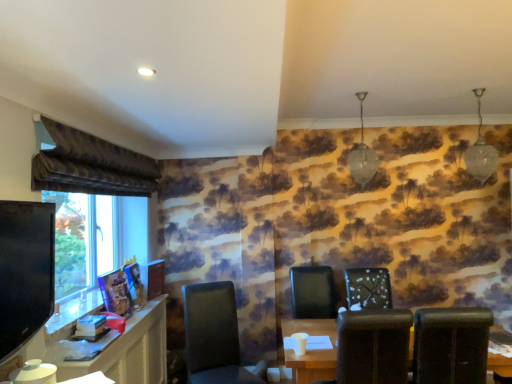
What do you see at coordinates (91, 165) in the screenshot? I see `velvet brown curtain at upper left` at bounding box center [91, 165].

What are the coordinates of `white textured chair at center, the second chair viewed from the right` in the screenshot? It's located at (368, 288).

This screenshot has height=384, width=512. Identify the location of matte brown table at lower center. (313, 350).

This screenshot has height=384, width=512. I want to click on matte black chair at center, which is the 1th chair from left to right, so click(x=214, y=336).

Describe the element at coordinates (373, 346) in the screenshot. I see `brown leather chair at center, which is counted as the 3th chair, starting from the right` at that location.

This screenshot has width=512, height=384. In order to click on velvet brown curtain at upper left in this screenshot , I will do `click(91, 165)`.

Consider the image. Is black leather chair at lower right, acting as the 4th chair starting from the left, shorter than matte black chair at center, which ranks as the fourth chair in right-to-left order?

Indeed, black leather chair at lower right, acting as the 4th chair starting from the left, has a lesser height compared to matte black chair at center, which ranks as the fourth chair in right-to-left order.

What are the coordinates of `the 1st chair in front of the matte black chair at center, which is the 1th chair from left to right, counting from the anchor's position` in the screenshot? It's located at (451, 345).

From a real-world perspective, is black leather chair at lower right, acting as the 4th chair starting from the left, on top of matte black chair at center, which is the 1th chair from left to right?

Yes, from a real-world perspective, black leather chair at lower right, acting as the 4th chair starting from the left, is on top of matte black chair at center, which is the 1th chair from left to right.

Is matte black chair at center, which ranks as the fourth chair in right-to-left order, inside black leather chair at lower right, the 1th chair viewed from the right?

No, matte black chair at center, which ranks as the fourth chair in right-to-left order, is not surrounded by black leather chair at lower right, the 1th chair viewed from the right.

Is matte brown table at lower center to the right of matte black computer desk at lower left from the viewer's perspective?

Yes.

From a real-world perspective, is matte brown table at lower center under matte black computer desk at lower left?

No, from a real-world perspective, matte brown table at lower center is not below matte black computer desk at lower left.

What's the angular difference between matte brown table at lower center and matte black computer desk at lower left's facing directions?

The angular difference between matte brown table at lower center and matte black computer desk at lower left is 89.6 degrees.

Considering the positions of points (300, 380) and (119, 367), is point (300, 380) farther from camera compared to point (119, 367)?

That is False.

Is velvet brown curtain at upper left closer to the viewer compared to black glossy tv at left?

No, velvet brown curtain at upper left is further to the viewer.

Considering the positions of objects velvet brown curtain at upper left and black glossy tv at left in the image provided, who is more to the right, velvet brown curtain at upper left or black glossy tv at left?

black glossy tv at left is more to the right.

Locate an element on the screen. The image size is (512, 384). television below the velvet brown curtain at upper left (from the image's perspective) is located at coordinates (25, 271).

Can you confirm if brown leather chair at center, which is counted as the 3th chair, starting from the right, is taller than matte black computer desk at lower left?

Incorrect, the height of brown leather chair at center, which is counted as the 3th chair, starting from the right, is not larger of that of matte black computer desk at lower left.

Does point (384, 378) come behind point (108, 349)?

Yes, it is.

Which is behind, brown leather chair at center, the second chair when ordered from left to right, or matte black computer desk at lower left?

brown leather chair at center, the second chair when ordered from left to right, is further from the camera.

From the image's perspective, between brown leather chair at center, the second chair when ordered from left to right, and matte black computer desk at lower left, who is located below?

matte black computer desk at lower left appears lower in the image.

Between black leather chair at lower right, the 1th chair viewed from the right, and brown leather chair at center, which is counted as the 3th chair, starting from the right, which one has less height?

With less height is black leather chair at lower right, the 1th chair viewed from the right.

From the image's perspective, who appears lower, black leather chair at lower right, the 1th chair viewed from the right, or brown leather chair at center, which is counted as the 3th chair, starting from the right?

From the image's view, brown leather chair at center, which is counted as the 3th chair, starting from the right, is below.

From a real-world perspective, is black leather chair at lower right, the 1th chair viewed from the right, over brown leather chair at center, which is counted as the 3th chair, starting from the right?

No.

Which object is further away from the camera, black leather chair at lower right, the 1th chair viewed from the right, or brown leather chair at center, which is counted as the 3th chair, starting from the right?

black leather chair at lower right, the 1th chair viewed from the right, is further away from the camera.

Which object is further away from the camera, matte black chair at center, which ranks as the fourth chair in right-to-left order, or velvet brown curtain at upper left?

matte black chair at center, which ranks as the fourth chair in right-to-left order, is behind.

Could you tell me if matte black chair at center, which is the 1th chair from left to right, is facing velvet brown curtain at upper left?

No, matte black chair at center, which is the 1th chair from left to right, is not turned towards velvet brown curtain at upper left.

Consider the image. Are matte black chair at center, which ranks as the fourth chair in right-to-left order, and velvet brown curtain at upper left far apart?

Yes, matte black chair at center, which ranks as the fourth chair in right-to-left order, and velvet brown curtain at upper left are quite far apart.

From the picture: From a real-world perspective, between matte black chair at center, which is the 1th chair from left to right, and velvet brown curtain at upper left, who is vertically lower?

matte black chair at center, which is the 1th chair from left to right, is physically lower.

Which is more to the left, matte black computer desk at lower left or matte brown table at lower center?

matte black computer desk at lower left is more to the left.

How distant is matte black computer desk at lower left from matte brown table at lower center?

matte black computer desk at lower left is 3.76 feet away from matte brown table at lower center.

From the image's perspective, relative to matte brown table at lower center, is matte black computer desk at lower left above or below?

Clearly, from the image's perspective, matte black computer desk at lower left is below matte brown table at lower center.

Could you tell me if matte black computer desk at lower left is turned towards matte brown table at lower center?

Yes, matte black computer desk at lower left is aimed at matte brown table at lower center.

From the image's perspective, starting from the matte black chair at center, which is the 1th chair from left to right, which chair is the 2nd one above? Please provide its 2D coordinates.

[(451, 345)]

You are a GUI agent. You are given a task and a screenshot of the screen. Output one action in this format:
    pyautogui.click(x=<x>, y=<y>)
    Task: Click on the table behind the matte black computer desk at lower left
    Image resolution: width=512 pixels, height=384 pixels.
    Given the screenshot: What is the action you would take?
    pyautogui.click(x=313, y=350)

Which object lies nearer to the anchor point brown leather chair at center, which is counted as the 3th chair, starting from the right, matte black computer desk at lower left or matte brown table at lower center?

matte brown table at lower center.

Which object lies further to the anchor point white textured chair at center, the second chair viewed from the right, matte black chair at center, which ranks as the fourth chair in right-to-left order, or brown leather chair at center, which is counted as the 3th chair, starting from the right?

matte black chair at center, which ranks as the fourth chair in right-to-left order, is further to white textured chair at center, the second chair viewed from the right.

Which object lies further to the anchor point brown leather chair at center, which is counted as the 3th chair, starting from the right, white textured chair at center, which is counted as the third chair, starting from the left, or matte black chair at center, which ranks as the fourth chair in right-to-left order?

Based on the image, matte black chair at center, which ranks as the fourth chair in right-to-left order, appears to be further to brown leather chair at center, which is counted as the 3th chair, starting from the right.

Estimate the real-world distances between objects in this image. Which object is further from velvet brown curtain at upper left, matte brown table at lower center or matte black computer desk at lower left?

Among the two, matte brown table at lower center is located further to velvet brown curtain at upper left.

Based on their spatial positions, is black leather chair at lower right, the 1th chair viewed from the right, or matte black computer desk at lower left further from velvet brown curtain at upper left?

Among the two, black leather chair at lower right, the 1th chair viewed from the right, is located further to velvet brown curtain at upper left.

From the image, which object appears to be farther from matte black chair at center, which ranks as the fourth chair in right-to-left order, matte black computer desk at lower left or brown leather chair at center, the second chair when ordered from left to right?

brown leather chair at center, the second chair when ordered from left to right, is further to matte black chair at center, which ranks as the fourth chair in right-to-left order.

Which object lies nearer to the anchor point matte black computer desk at lower left, black leather chair at lower right, the 1th chair viewed from the right, or velvet brown curtain at upper left?

The object closer to matte black computer desk at lower left is velvet brown curtain at upper left.

Looking at this image, looking at the image, which one is located further to brown leather chair at center, the second chair when ordered from left to right, white textured chair at center, the second chair viewed from the right, or velvet brown curtain at upper left?

velvet brown curtain at upper left lies further to brown leather chair at center, the second chair when ordered from left to right, than the other object.

Find the location of `chair situated between matte black computer desk at lower left and brown leather chair at center, which is counted as the 3th chair, starting from the right, from left to right`. chair situated between matte black computer desk at lower left and brown leather chair at center, which is counted as the 3th chair, starting from the right, from left to right is located at coordinates (214, 336).

Where is `computer desk between velvet brown curtain at upper left and black leather chair at lower right, acting as the 4th chair starting from the left, from left to right`? computer desk between velvet brown curtain at upper left and black leather chair at lower right, acting as the 4th chair starting from the left, from left to right is located at coordinates (125, 351).

Where is `computer desk between velvet brown curtain at upper left and matte brown table at lower center`? This screenshot has width=512, height=384. computer desk between velvet brown curtain at upper left and matte brown table at lower center is located at coordinates (125, 351).

The height and width of the screenshot is (384, 512). Find the location of `computer desk between velvet brown curtain at upper left and white textured chair at center, which is counted as the third chair, starting from the left, from left to right`. computer desk between velvet brown curtain at upper left and white textured chair at center, which is counted as the third chair, starting from the left, from left to right is located at coordinates [x=125, y=351].